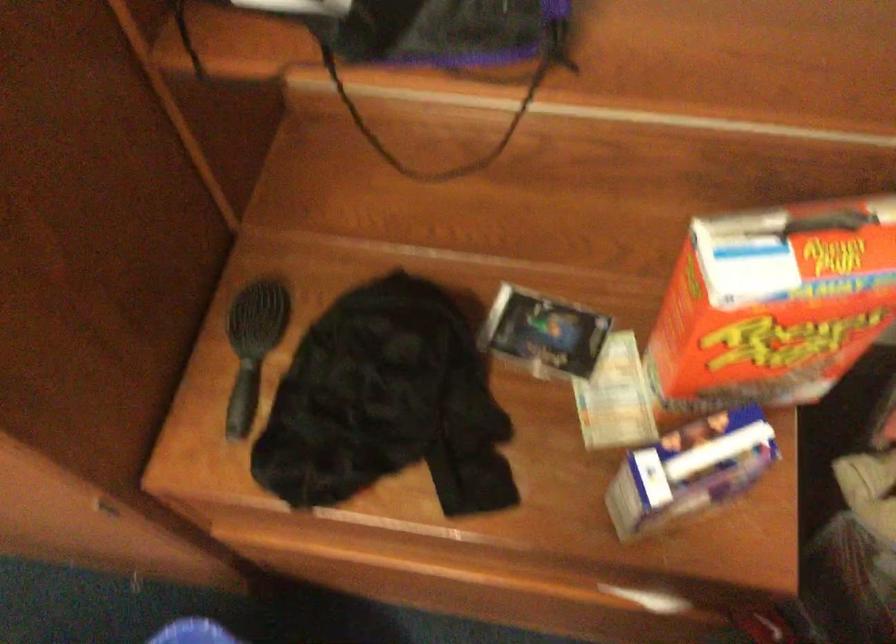
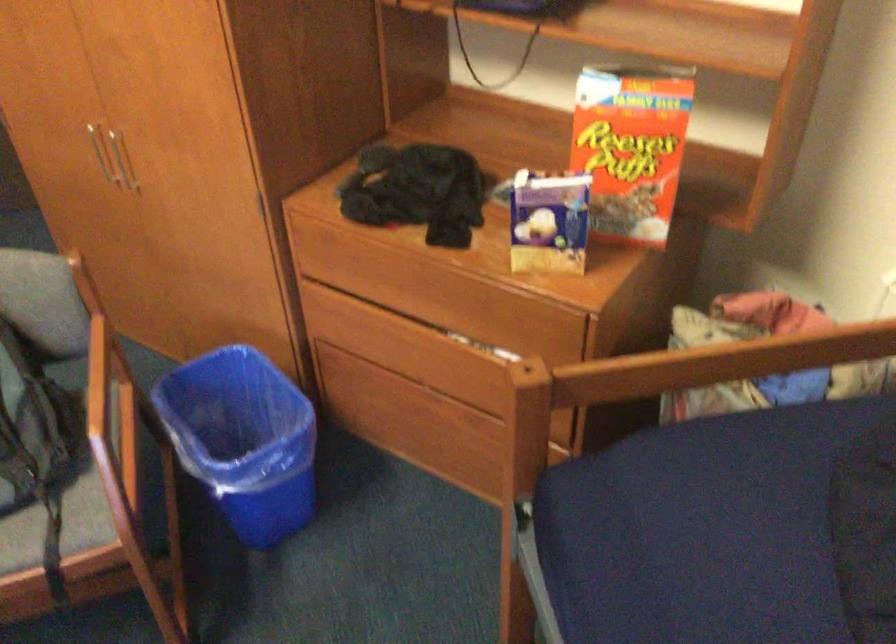
Question: I am providing you with two images of the same scene from different viewpoints. Please identify which objects are invisible in image2.

Choices:
 (A) small food carton
 (B) chair sitting surface
 (C) drawer pull
 (D) none of these

Answer: (D)